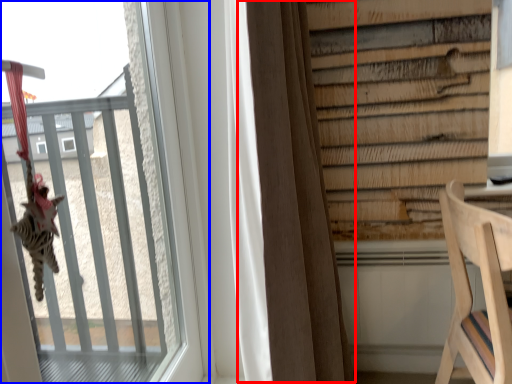
Question: Which of the following is the farthest to the observer, curtain (highlighted by a red box) or window (highlighted by a blue box)?

Choices:
 (A) curtain
 (B) window

Answer: (A)